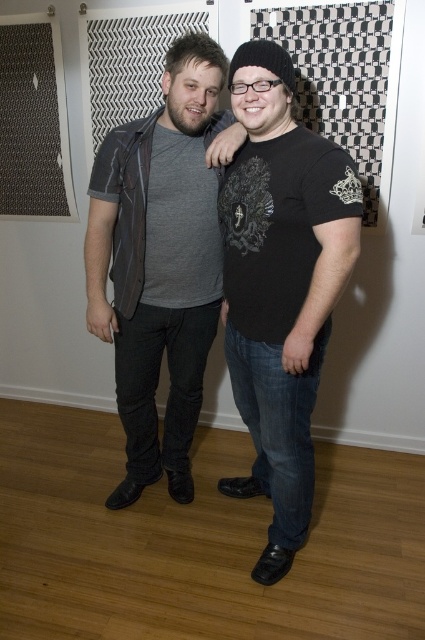
Question: Is black matte t-shirt at center closer to camera compared to matte gray shirt at center?

Choices:
 (A) no
 (B) yes

Answer: (B)

Question: Is black matte t-shirt at center bigger than matte gray shirt at center?

Choices:
 (A) no
 (B) yes

Answer: (A)

Question: From the image, what is the correct spatial relationship of black matte t-shirt at center in relation to matte gray shirt at center?

Choices:
 (A) below
 (B) above

Answer: (A)